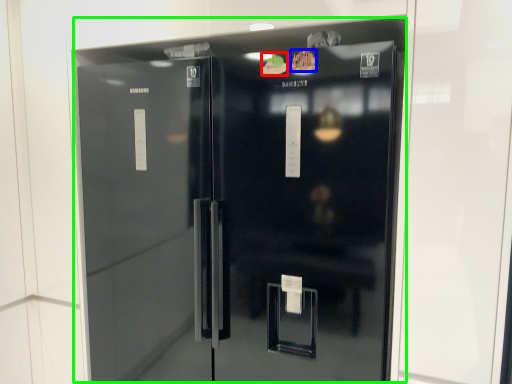
Question: Based on their relative distances, which object is nearer to food (highlighted by a red box)? Choose from food (highlighted by a blue box) and refrigerator (highlighted by a green box).

Choices:
 (A) food
 (B) refrigerator

Answer: (A)